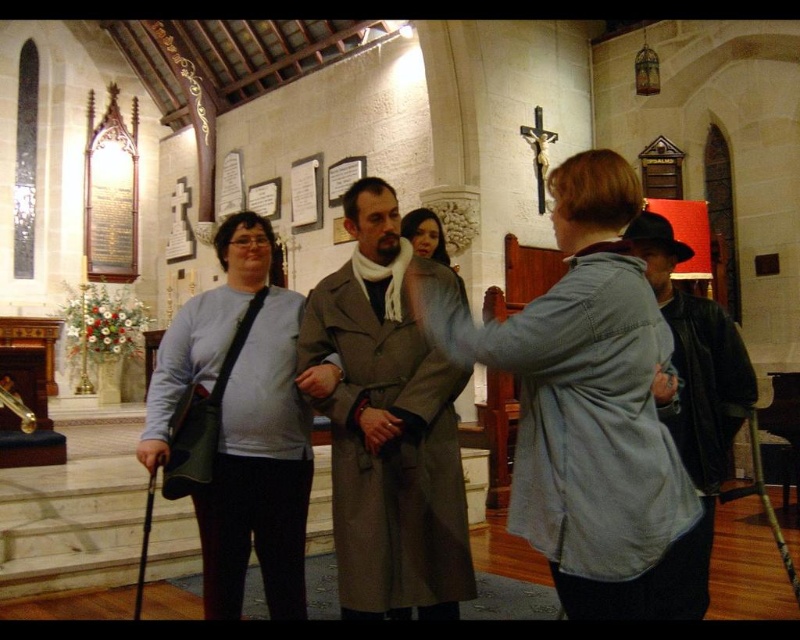
Question: Considering the real-world distances, which object is closest to the denim jacket at center?

Choices:
 (A) light brown wool coat at center
 (B) light blue sweater at center
 (C) dark brown leather jacket at right

Answer: (C)

Question: Which point is closer to the camera taking this photo?

Choices:
 (A) (636, 410)
 (B) (316, 349)
 (C) (720, 369)
 (D) (222, 614)

Answer: (A)

Question: Among these objects, which one is nearest to the camera?

Choices:
 (A) light blue sweater at center
 (B) dark brown leather jacket at right

Answer: (A)

Question: Can you confirm if denim jacket at center is positioned to the right of light blue sweater at center?

Choices:
 (A) no
 (B) yes

Answer: (B)

Question: Is denim jacket at center bigger than light brown wool coat at center?

Choices:
 (A) no
 (B) yes

Answer: (B)

Question: Does denim jacket at center have a lesser width compared to light blue sweater at center?

Choices:
 (A) yes
 (B) no

Answer: (B)